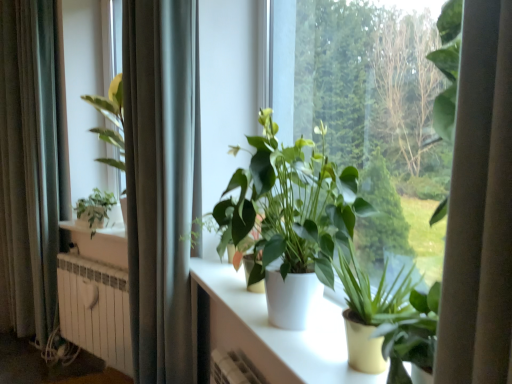
The image size is (512, 384). Find the location of `blank area beneath white matte plant pot at center, which is counted as the second houseplant, starting from the right (from a real-world perspective)`. blank area beneath white matte plant pot at center, which is counted as the second houseplant, starting from the right (from a real-world perspective) is located at coordinates (296, 336).